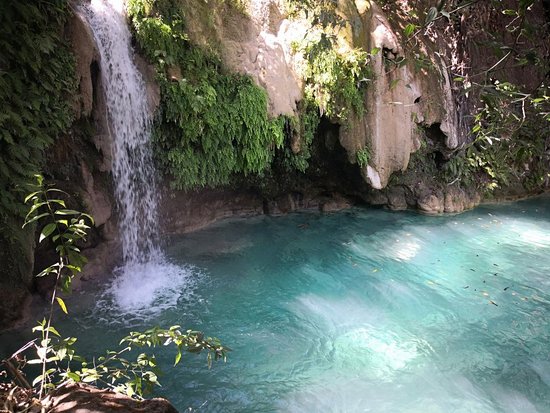
This screenshot has height=413, width=550. In order to click on wall in this screenshot , I will do `click(278, 66)`.